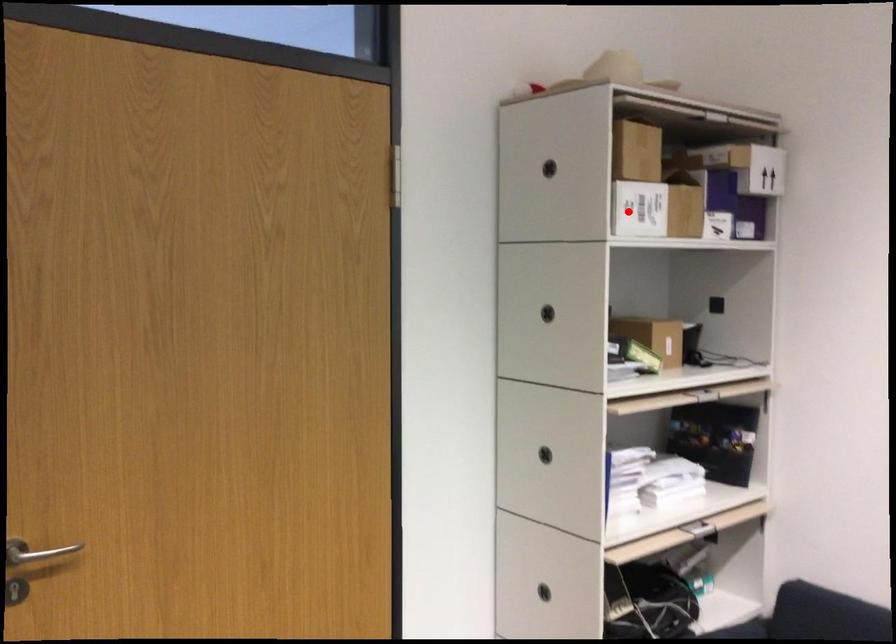
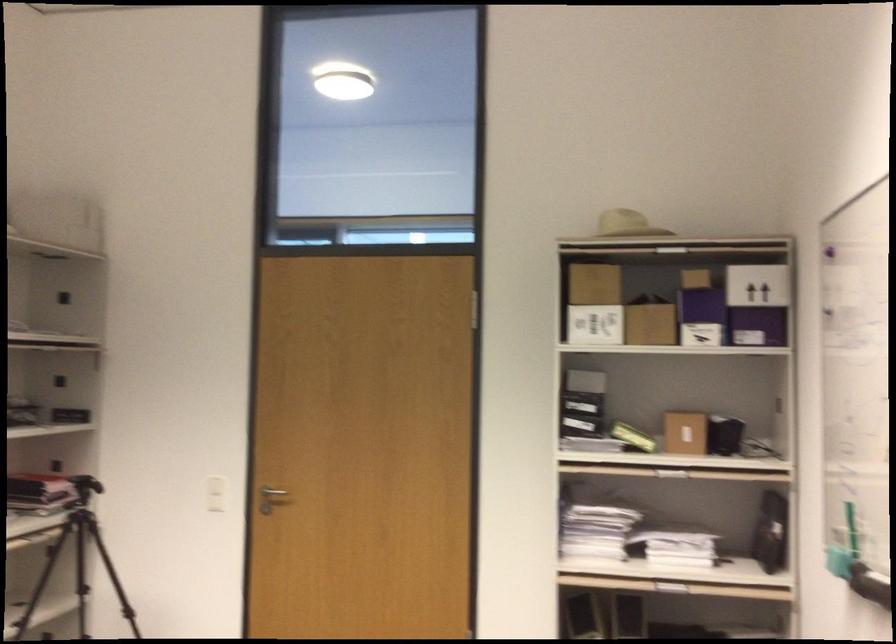
Question: I am providing you with two images of the same scene from different viewpoints. Given a red point in image1, look at the same physical point in image2. Is it:

Choices:
 (A) Closer to the viewpoint
 (B) Farther from the viewpoint

Answer: (B)